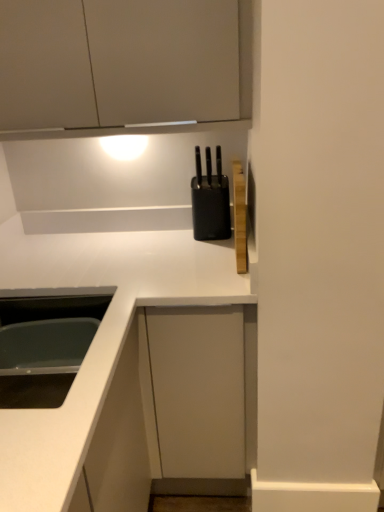
Where is `white glossy sink at lower left`? Image resolution: width=384 pixels, height=512 pixels. white glossy sink at lower left is located at coordinates (46, 342).

In the scene shown: From a real-world perspective, is matte gray cabinet at upper left beneath white glossy sink at lower left?

No.

You are a GUI agent. You are given a task and a screenshot of the screen. Output one action in this format:
    pyautogui.click(x=<x>, y=<y>)
    Task: Click on the sink below the matte gray cabinet at upper left (from a real-world perspective)
    This screenshot has height=512, width=384.
    Given the screenshot: What is the action you would take?
    pyautogui.click(x=46, y=342)

Does point (207, 80) come in front of point (22, 346)?

Yes, point (207, 80) is in front of point (22, 346).

Who is taller, white glossy countertop at center or white glossy sink at lower left?

With more height is white glossy countertop at center.

Measure the distance between white glossy countertop at center and white glossy sink at lower left.

They are 9.01 inches apart.

From a real-world perspective, which object rests below the other?

white glossy countertop at center is physically lower.

Does white glossy countertop at center appear on the left side of white glossy sink at lower left?

No, white glossy countertop at center is not to the left of white glossy sink at lower left.

From a real-world perspective, which object rests below the other?

In real-world perspective, white glossy countertop at center is lower.

From the image's perspective, between white glossy countertop at center and black plastic knife block at upper center, who is located below?

white glossy countertop at center, from the image's perspective.

Considering the relative sizes of white glossy countertop at center and black plastic knife block at upper center in the image provided, is white glossy countertop at center wider than black plastic knife block at upper center?

Correct, the width of white glossy countertop at center exceeds that of black plastic knife block at upper center.

Between point (24, 453) and point (218, 212), which one is positioned in front?

The point (24, 453) is closer to the camera.

From the image's perspective, between white glossy countertop at center and matte gray cabinet at upper left, who is located below?

white glossy countertop at center appears lower in the image.

Could you tell me if white glossy countertop at center is turned towards matte gray cabinet at upper left?

No, white glossy countertop at center is not oriented towards matte gray cabinet at upper left.

Between white glossy countertop at center and matte gray cabinet at upper left, which one is positioned in front?

matte gray cabinet at upper left is closer to the camera.

Is white glossy countertop at center taller or shorter than matte gray cabinet at upper left?

white glossy countertop at center is taller than matte gray cabinet at upper left.

Based on the photo, does black plastic knife block at upper center have a smaller size compared to matte gray cabinet at upper left?

Yes.

Which is more to the right, black plastic knife block at upper center or matte gray cabinet at upper left?

From the viewer's perspective, black plastic knife block at upper center appears more on the right side.

Find the location of `cabinetry that is on the left side of black plastic knife block at upper center`. cabinetry that is on the left side of black plastic knife block at upper center is located at coordinates (123, 66).

From the picture: Can we say black plastic knife block at upper center lies outside matte gray cabinet at upper left?

black plastic knife block at upper center lies outside matte gray cabinet at upper left's area.

Could you tell me if black plastic knife block at upper center is turned towards white glossy sink at lower left?

No.

Is black plastic knife block at upper center inside the boundaries of white glossy sink at lower left, or outside?

black plastic knife block at upper center cannot be found inside white glossy sink at lower left.

Between point (198, 205) and point (10, 296), which one is positioned in front?

Point (10, 296)

Between black plastic knife block at upper center and white glossy sink at lower left, which one has smaller size?

black plastic knife block at upper center.

Is white glossy sink at lower left thinner than black plastic knife block at upper center?

Incorrect, the width of white glossy sink at lower left is not less than that of black plastic knife block at upper center.

Is white glossy sink at lower left with black plastic knife block at upper center?

They are not placed beside each other.

In terms of height, does white glossy sink at lower left look taller or shorter compared to black plastic knife block at upper center?

In the image, white glossy sink at lower left appears to be shorter than black plastic knife block at upper center.

From the image's perspective, is white glossy sink at lower left under black plastic knife block at upper center?

Yes.

The image size is (384, 512). Find the location of `cabinetry behind the white glossy sink at lower left`. cabinetry behind the white glossy sink at lower left is located at coordinates (123, 66).

Locate an element on the screen. This screenshot has width=384, height=512. sink lying in front of the white glossy countertop at center is located at coordinates (46, 342).

Which object lies further to the anchor point black plastic knife block at upper center, white glossy sink at lower left or white glossy countertop at center?

The object further to black plastic knife block at upper center is white glossy sink at lower left.

When comparing their distances from white glossy countertop at center, does white glossy sink at lower left or matte gray cabinet at upper left seem closer?

Among the two, white glossy sink at lower left is located nearer to white glossy countertop at center.

When comparing their distances from matte gray cabinet at upper left, does white glossy sink at lower left or black plastic knife block at upper center seem further?

Among the two, white glossy sink at lower left is located further to matte gray cabinet at upper left.

From the image, which object appears to be nearer to matte gray cabinet at upper left, white glossy countertop at center or white glossy sink at lower left?

white glossy countertop at center is closer to matte gray cabinet at upper left.

Looking at the image, which one is located further to white glossy countertop at center, black plastic knife block at upper center or matte gray cabinet at upper left?

Based on the image, matte gray cabinet at upper left appears to be further to white glossy countertop at center.

Estimate the real-world distances between objects in this image. Which object is closer to white glossy countertop at center, matte gray cabinet at upper left or black plastic knife block at upper center?

Based on the image, black plastic knife block at upper center appears to be nearer to white glossy countertop at center.

Based on their spatial positions, is matte gray cabinet at upper left or white glossy sink at lower left further from black plastic knife block at upper center?

Based on the image, white glossy sink at lower left appears to be further to black plastic knife block at upper center.

Based on the photo, looking at the image, which one is located further to white glossy sink at lower left, black plastic knife block at upper center or white glossy countertop at center?

The object further to white glossy sink at lower left is black plastic knife block at upper center.

I want to click on sink between black plastic knife block at upper center and white glossy countertop at center in the up-down direction, so click(x=46, y=342).

Identify the location of appliance between matte gray cabinet at upper left and white glossy sink at lower left in the vertical direction. (210, 200).

You are a GUI agent. You are given a task and a screenshot of the screen. Output one action in this format:
    pyautogui.click(x=<x>, y=<y>)
    Task: Click on the sink between matte gray cabinet at upper left and white glossy countertop at center vertically
    This screenshot has height=512, width=384.
    Given the screenshot: What is the action you would take?
    pyautogui.click(x=46, y=342)

What are the coordinates of `appliance between matte gray cabinet at upper left and white glossy countertop at center in the vertical direction` in the screenshot? It's located at (210, 200).